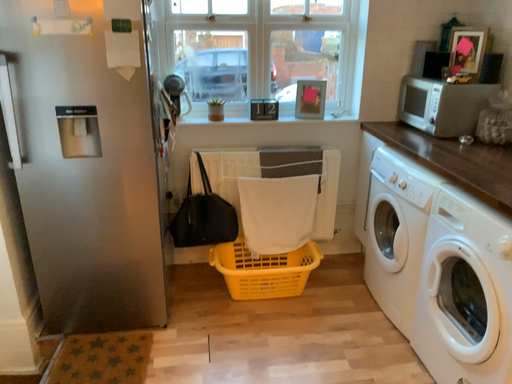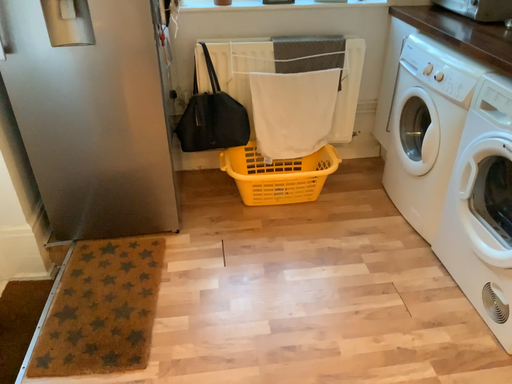
Question: How did the camera likely rotate when shooting the video?

Choices:
 (A) rotated upward
 (B) rotated downward

Answer: (B)